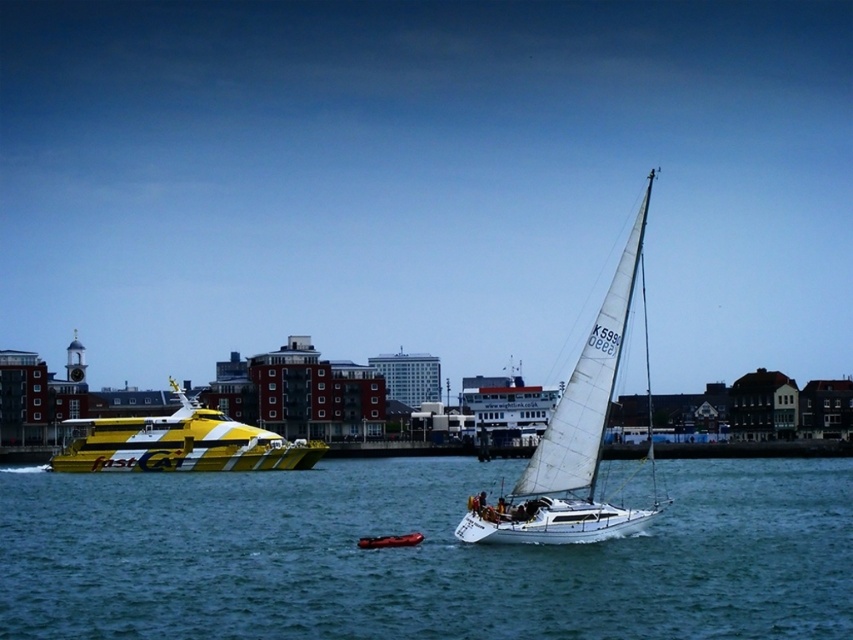
Question: Is the position of blue water at center less distant than that of white sailboat at center?

Choices:
 (A) yes
 (B) no

Answer: (A)

Question: Which of these objects is positioned farthest from the yellow striped catamaran at left?

Choices:
 (A) blue water at center
 (B) white sailboat at center

Answer: (B)

Question: Observing the image, what is the correct spatial positioning of white sailboat at center in reference to yellow striped catamaran at left?

Choices:
 (A) right
 (B) left

Answer: (A)

Question: Among these objects, which one is farthest from the camera?

Choices:
 (A) yellow striped catamaran at left
 (B) white sailboat at center
 (C) blue water at center

Answer: (A)

Question: Among these objects, which one is farthest from the camera?

Choices:
 (A) blue water at center
 (B) white sailboat at center
 (C) yellow striped catamaran at left

Answer: (C)

Question: Is white sailboat at center thinner than yellow striped catamaran at left?

Choices:
 (A) no
 (B) yes

Answer: (A)